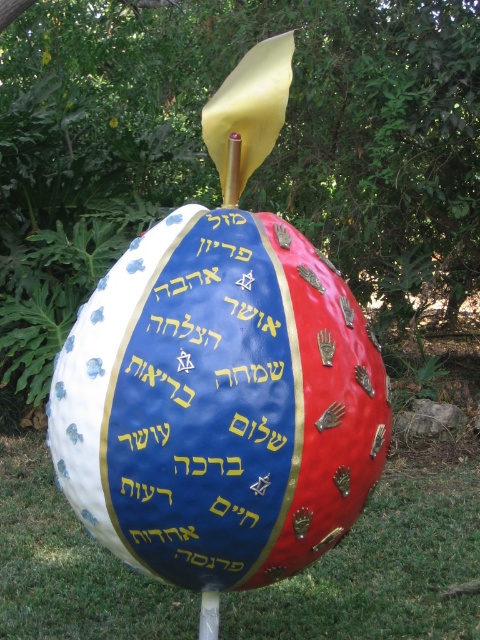
You are a landscape architect designing a garden pathway. You want to place a bench so that it faces the glossy metallic sphere at center while ensuring it doesn not block the view of the green grass at center. Where should the bench be positioned relative to these two objects?

The bench should be placed behind the glossy metallic sphere at center since it is thinner than the green grass at center, allowing the sphere to be visible in front while the grass remains visible beyond it.

You are standing in a garden and see the glossy metallic sphere at center and the green grass at center. Which object is closer to you?

The glossy metallic sphere at center is closer to you than the green grass at center because it is in front of the green grass at center.